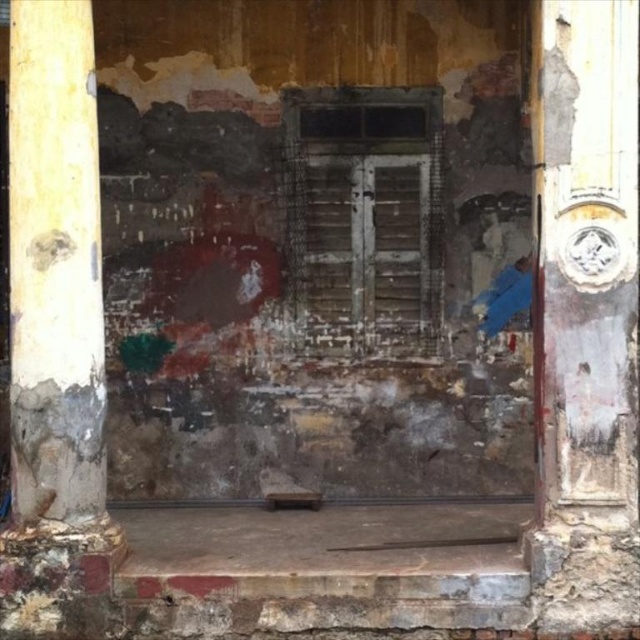
You are standing in front of the aged doorway. There is a point marked at coordinates (584,314). What object is located at that point?

The point at coordinates (584,314) indicates the rusty metal door at right.

You are a contractor assessing the structural integrity of an old building. You need to determine if the rusty metal door at right can be safely opened without damaging the weathered wood pillar at left. The minimum safe distance required between the door and the pillar when the door is fully opened is 7 feet. Based on the scene, can the door be opened safely?

The distance between the rusty metal door at right and the weathered wood pillar at left is 6.85 feet, which is less than the required 7 feet. Therefore, opening the door may risk damaging the pillar and is not safe.